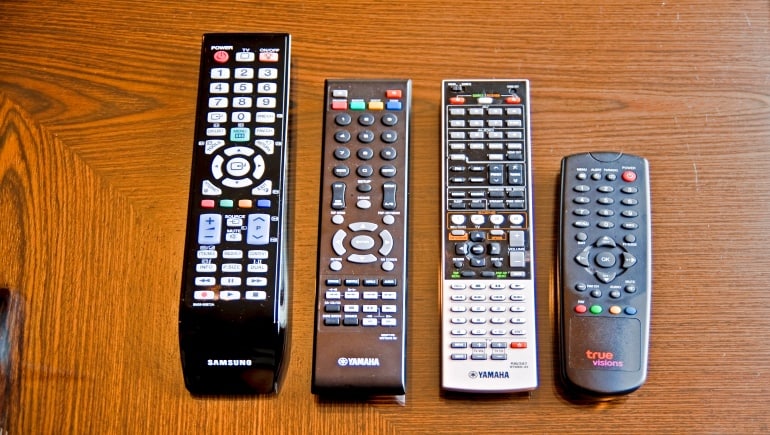
You are a GUI agent. You are given a task and a screenshot of the screen. Output one action in this format:
    pyautogui.click(x=<x>, y=<y>)
    Task: Click on the white yamaha remote control
    The height and width of the screenshot is (435, 770).
    Given the screenshot: What is the action you would take?
    pyautogui.click(x=490, y=374)